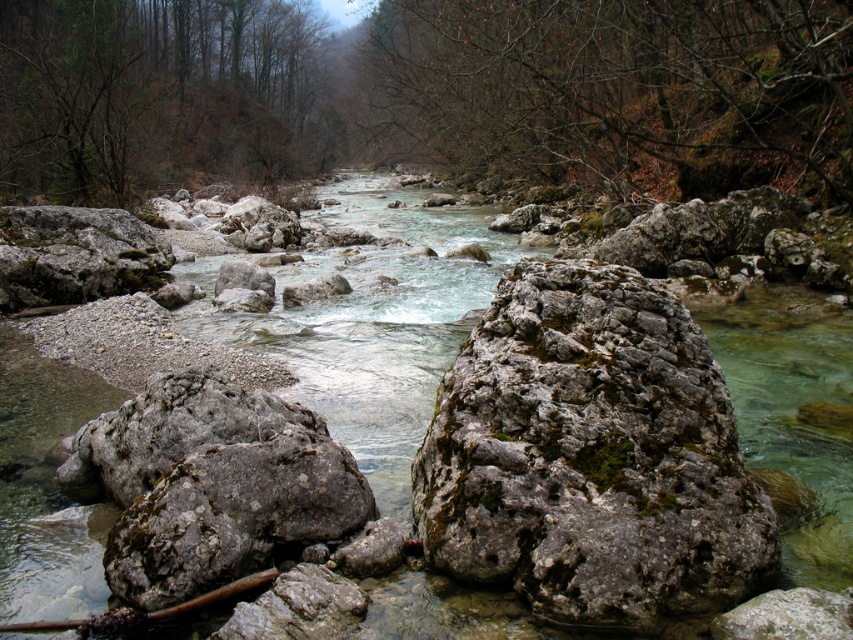
Image resolution: width=853 pixels, height=640 pixels. What do you see at coordinates (428, 92) in the screenshot? I see `green mossy rocks at center` at bounding box center [428, 92].

Does green mossy rocks at center appear on the left side of gray rough rock at center?

Correct, you'll find green mossy rocks at center to the left of gray rough rock at center.

Find the location of `green mossy rocks at center`. green mossy rocks at center is located at coordinates coord(428,92).

Does clear water stream at center have a smaller size compared to gray rough rock at center?

No.

Does clear water stream at center have a lesser height compared to gray rough rock at center?

No.

Where is `clear water stream at center`? This screenshot has width=853, height=640. clear water stream at center is located at coordinates (370, 323).

Image resolution: width=853 pixels, height=640 pixels. In order to click on clear water stream at center in this screenshot , I will do `click(370, 323)`.

Is green mossy rocks at center thinner than clear water stream at center?

No.

Which is below, green mossy rocks at center or clear water stream at center?

clear water stream at center is below.

This screenshot has width=853, height=640. Find the location of `green mossy rocks at center`. green mossy rocks at center is located at coordinates (428, 92).